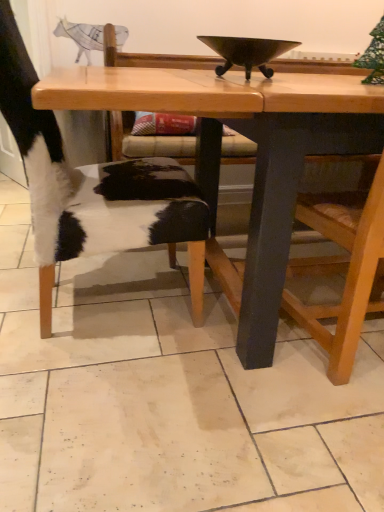
Question: Considering the positions of wooden chair at right and wooden table at center in the image, is wooden chair at right wider or thinner than wooden table at center?

Choices:
 (A) wide
 (B) thin

Answer: (B)

Question: Is wooden chair at right spatially inside wooden table at center, or outside of it?

Choices:
 (A) outside
 (B) inside

Answer: (B)

Question: Which object is positioned closest to the cowhide leather chair at left?

Choices:
 (A) shiny dark metal bowl at center
 (B) wooden table at center
 (C) wooden chair at right

Answer: (B)

Question: Which object is the farthest from the cowhide leather chair at left?

Choices:
 (A) wooden chair at right
 (B) shiny dark metal bowl at center
 (C) wooden table at center

Answer: (A)